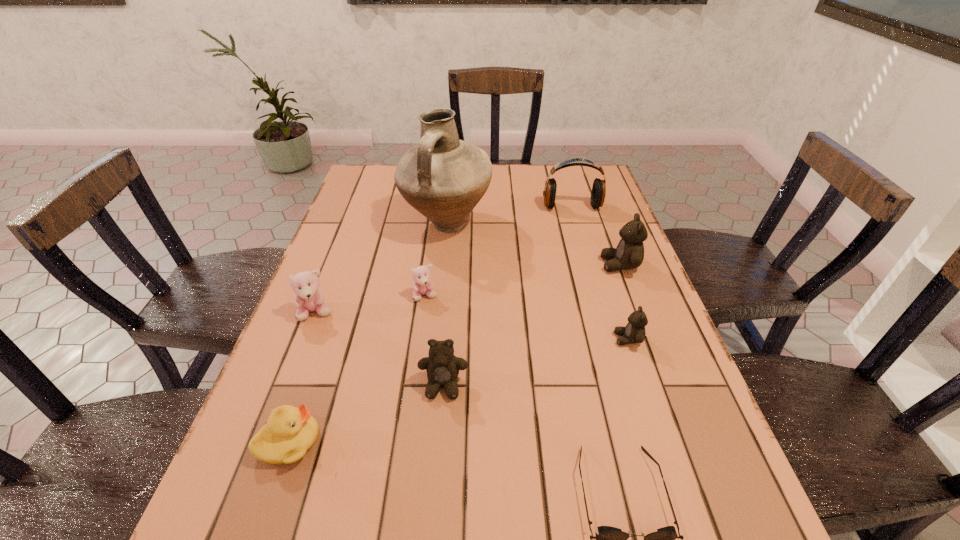
Identify the location of vacant space located 0.320m on the face of the second farthest brown teddy bear. (470, 339).

Locate an element on the screen. The width and height of the screenshot is (960, 540). vacant space located on the face of the second farthest brown teddy bear is located at coordinates (452, 339).

This screenshot has width=960, height=540. What are the coordinates of `vacant region located 0.180m at the face of the right pink teddy bear` in the screenshot? It's located at (417, 363).

This screenshot has width=960, height=540. Find the location of `free location located on the beak of the yellow duckling`. free location located on the beak of the yellow duckling is located at coordinates (368, 442).

Locate an element on the screen. This screenshot has width=960, height=540. teddy bear located in the left edge section of the desktop is located at coordinates (309, 297).

Image resolution: width=960 pixels, height=540 pixels. What are the coordinates of `duckling that is at the left edge` in the screenshot? It's located at (290, 432).

The height and width of the screenshot is (540, 960). Identify the location of headset positioned at the right edge. (598, 193).

The width and height of the screenshot is (960, 540). What are the coordinates of `vacant space at the left edge of the desktop` in the screenshot? It's located at (298, 326).

This screenshot has height=540, width=960. I want to click on vacant space at the right edge of the desktop, so click(610, 322).

Image resolution: width=960 pixels, height=540 pixels. In the image, there is a desktop. What are the coordinates of `free space at the far left corner` in the screenshot? It's located at (367, 168).